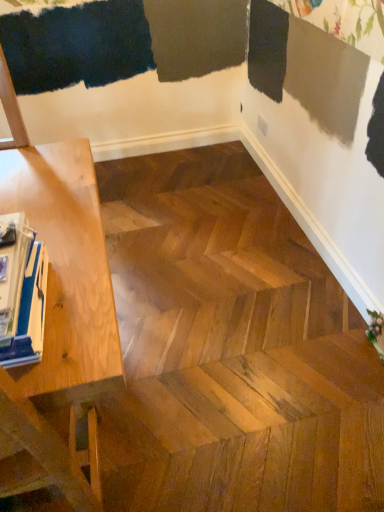
The width and height of the screenshot is (384, 512). In order to click on blue glossy magazine at left in this screenshot , I will do [x=21, y=292].

What is the approximate width of blue glossy magazine at left?

14.08 inches.

Image resolution: width=384 pixels, height=512 pixels. Describe the element at coordinates (21, 292) in the screenshot. I see `blue glossy magazine at left` at that location.

This screenshot has width=384, height=512. Find the location of `light wood table at left`. light wood table at left is located at coordinates (66, 274).

Describe the element at coordinates (66, 274) in the screenshot. I see `light wood table at left` at that location.

The height and width of the screenshot is (512, 384). I want to click on blue glossy magazine at left, so click(x=21, y=292).

Considering the relative positions of light wood table at left and blue glossy magazine at left in the image provided, is light wood table at left to the left of blue glossy magazine at left from the viewer's perspective?

Correct, you'll find light wood table at left to the left of blue glossy magazine at left.

Is light wood table at left further to camera compared to blue glossy magazine at left?

No, light wood table at left is closer to the viewer.

Considering the positions of points (90, 178) and (6, 348), is point (90, 178) closer to camera compared to point (6, 348)?

That is False.

From the image's perspective, between light wood table at left and blue glossy magazine at left, who is located below?

light wood table at left.

From a real-world perspective, which is physically above, light wood table at left or blue glossy magazine at left?

blue glossy magazine at left.

Is light wood table at left thinner than blue glossy magazine at left?

Incorrect, the width of light wood table at left is not less than that of blue glossy magazine at left.

Considering the sizes of objects light wood table at left and blue glossy magazine at left in the image provided, who is taller, light wood table at left or blue glossy magazine at left?

light wood table at left is taller.

Can you confirm if light wood table at left is bigger than blue glossy magazine at left?

Yes, light wood table at left is bigger than blue glossy magazine at left.

Choose the correct answer: Is light wood table at left inside blue glossy magazine at left or outside it?

light wood table at left is not enclosed by blue glossy magazine at left.

Is light wood table at left not near blue glossy magazine at left?

That's not correct — light wood table at left is a little close to blue glossy magazine at left.

Could you tell me if light wood table at left is facing blue glossy magazine at left?

No.

Identify the location of magazine above the light wood table at left (from a real-world perspective). (21, 292).

Would you say blue glossy magazine at left is to the left or to the right of light wood table at left in the picture?

Clearly, blue glossy magazine at left is on the right of light wood table at left in the image.

Which is behind, blue glossy magazine at left or light wood table at left?

blue glossy magazine at left is further from the camera.

Which is further, (24, 356) or (95, 314)?

The point (95, 314) is more distant.

From the image's perspective, is blue glossy magazine at left on light wood table at left?

Correct, blue glossy magazine at left appears higher than light wood table at left in the image.

From a real-world perspective, which object rests below the other?

light wood table at left.

Which of these two, blue glossy magazine at left or light wood table at left, is wider?

light wood table at left.

Considering the sizes of objects blue glossy magazine at left and light wood table at left in the image provided, who is shorter, blue glossy magazine at left or light wood table at left?

blue glossy magazine at left.

Does blue glossy magazine at left have a smaller size compared to light wood table at left?

Yes.

Is blue glossy magazine at left located outside light wood table at left?

No, blue glossy magazine at left is not outside of light wood table at left.

Are blue glossy magazine at left and light wood table at left far apart?

They are positioned close to each other.

Based on the photo, could you tell me if blue glossy magazine at left is facing light wood table at left?

Yes.

Locate an element on the screen. Image resolution: width=384 pixels, height=512 pixels. table that appears in front of the blue glossy magazine at left is located at coordinates (66, 274).

In the image, there is a blue glossy magazine at left. In order to click on table below it (from the image's perspective) in this screenshot , I will do `click(66, 274)`.

Locate an element on the screen. magazine lying on the right of light wood table at left is located at coordinates (21, 292).